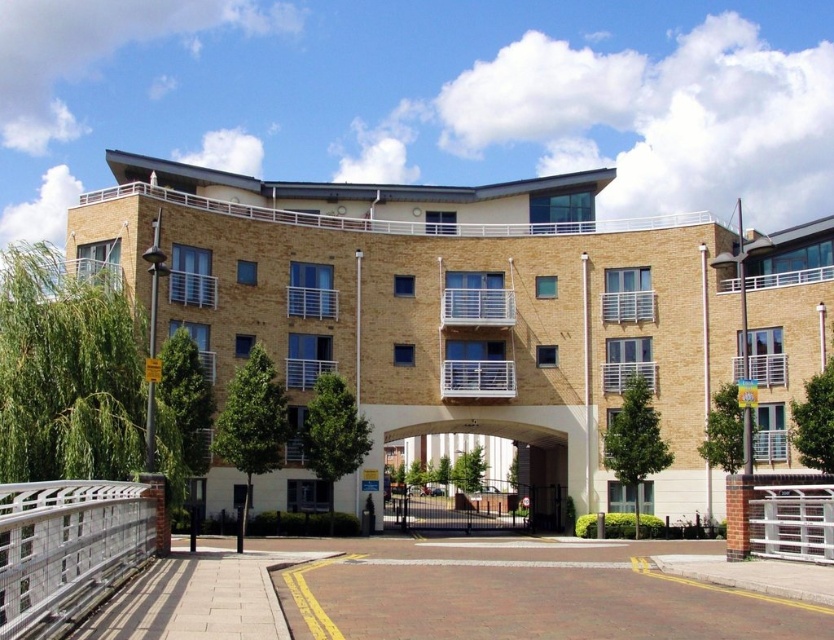
You are a delivery person standing at the entrance of the beige brick building at center. You need to place a heavy box on the silver metallic rail at lower left. Can you safely place it there without needing to climb any stairs?

Answer: The beige brick building at center is much taller than the silver metallic rail at lower left, so the rail is at a lower position. Since you are at the entrance level, you can safely place the box on the silver metallic rail at lower left without needing to climb stairs.